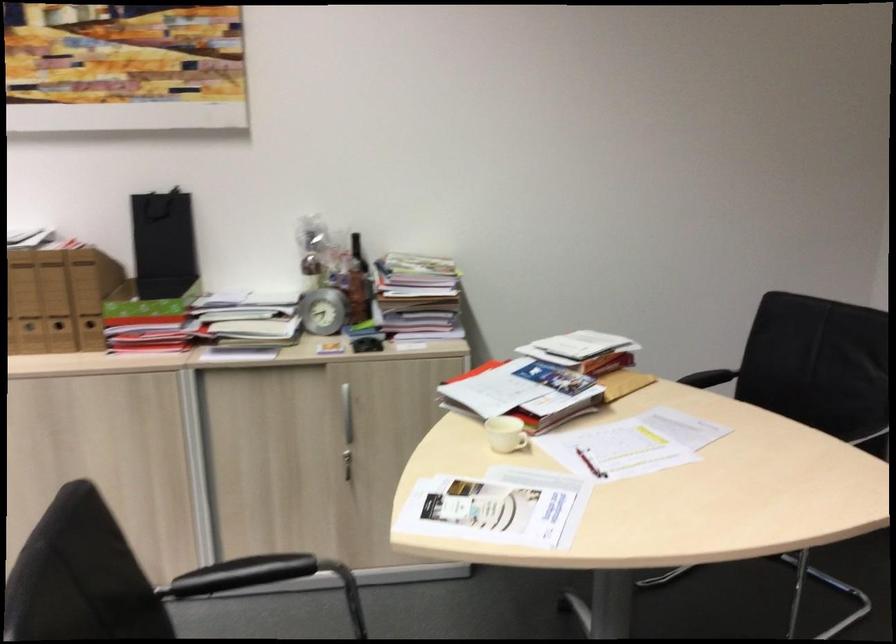
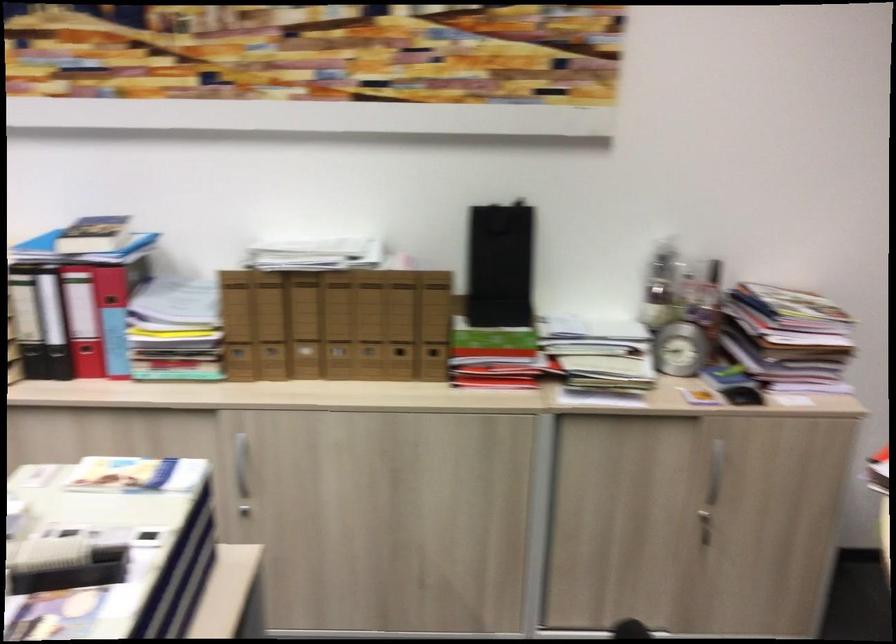
Question: The camera is either moving clockwise (left) or counter-clockwise (right) around the object. The first image is from the beginning of the video and the second image is from the end. Is the camera moving left or right when shooting the video?

Choices:
 (A) Left
 (B) Right

Answer: (B)